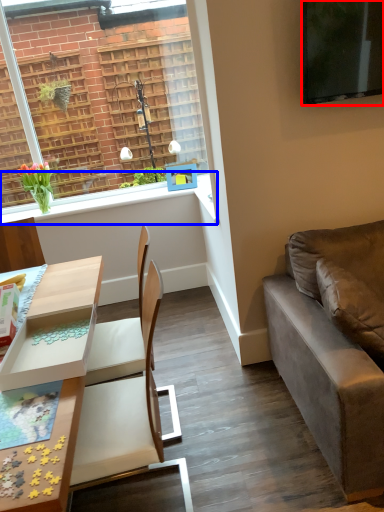
Question: Which of the following is the closest to the observer, television (highlighted by a red box) or window sill (highlighted by a blue box)?

Choices:
 (A) television
 (B) window sill

Answer: (A)